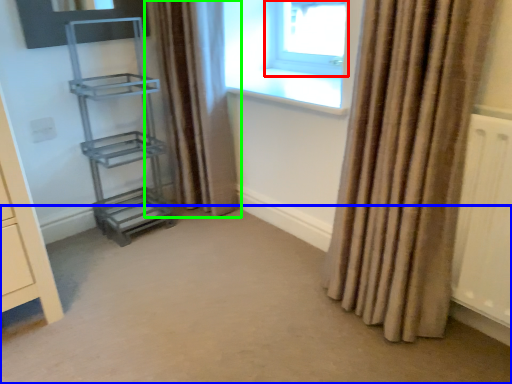
Question: Which is farther away from window (highlighted by a red box)? plain (highlighted by a blue box) or curtain (highlighted by a green box)?

Choices:
 (A) plain
 (B) curtain

Answer: (A)